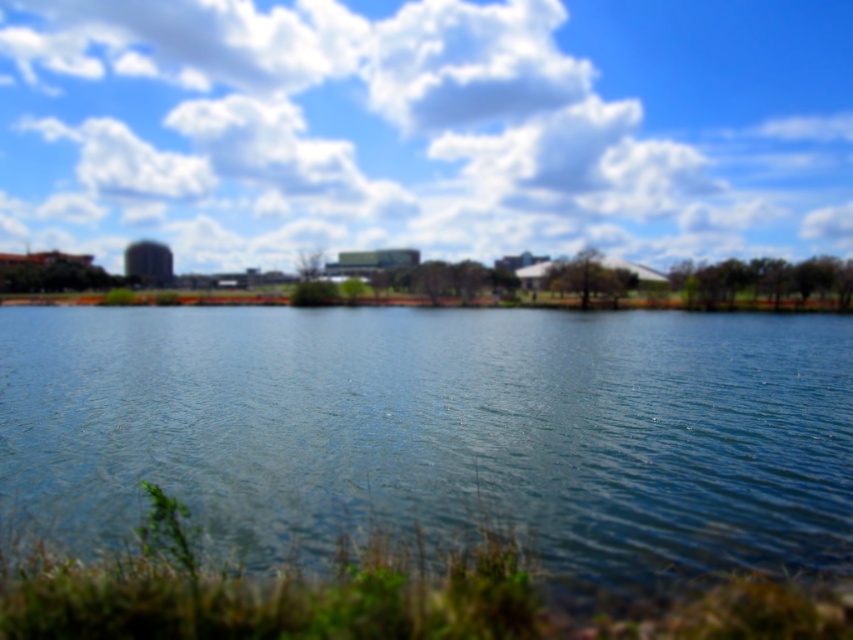
You are standing at the lakeside and looking at the image. There is a point marked at coordinates point (426, 128). What object in the scene is located at this point?

The point (426, 128) corresponds to the white fluffy cloud at upper center.

You are a photographer planning to capture the entire scene in one shot. Considering the white fluffy cloud at upper center and the clear water at center, which one appears wider in the image?

The white fluffy cloud at upper center appears wider than the clear water at center as its width surpasses the latter.

From the picture: You are standing at the lakeside and want to throw a stone to hit both the white fluffy cloud at upper center and the clear water at center. Is it possible to do so in a single throw?

The distance between the white fluffy cloud at upper center and the clear water at center is 179.80 meters. Since the cloud is in the sky and the water is on the ground, you cannot hit both with a single stone throw as they are not on the same plane.